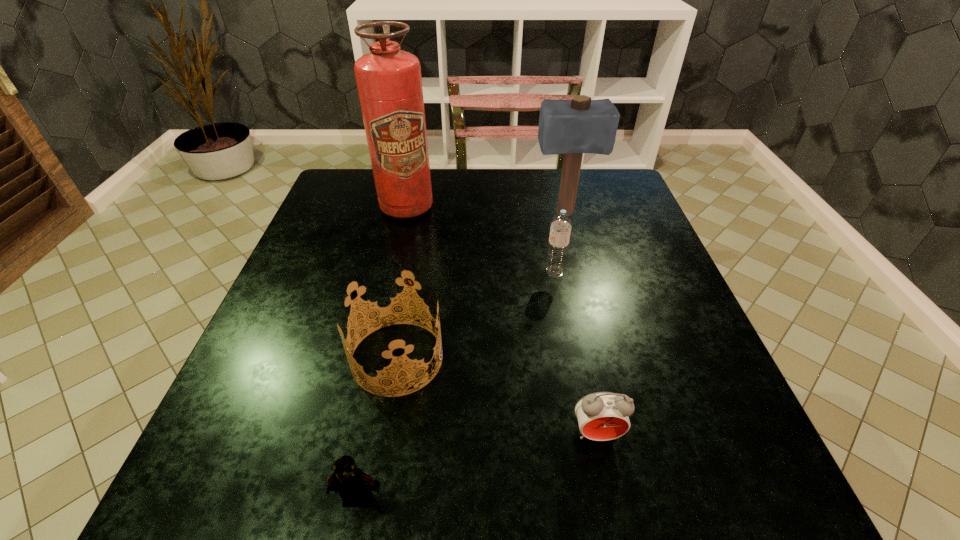
The image size is (960, 540). Identify the location of vacant space located 0.100m on the face of the second nearest object. (614, 516).

At what (x,y) coordinates should I click in order to perform the action: click on fire extinguisher located in the far edge section of the desktop. Please return your answer as a coordinate pair (x, y). This screenshot has width=960, height=540. Looking at the image, I should click on (389, 82).

I want to click on mallet that is at the far edge, so click(x=572, y=127).

Locate an element on the screen. Image resolution: width=960 pixels, height=540 pixels. object positioned at the near edge is located at coordinates (352, 484).

Find the location of a particular element. object that is at the left edge is located at coordinates (389, 82).

The width and height of the screenshot is (960, 540). In order to click on object situated at the right edge in this screenshot , I will do `click(572, 127)`.

Where is `object located in the far left corner section of the desktop`? This screenshot has height=540, width=960. object located in the far left corner section of the desktop is located at coordinates (389, 82).

This screenshot has width=960, height=540. Find the location of `object present at the far right corner`. object present at the far right corner is located at coordinates (572, 127).

Identify the location of vacant space at the far edge of the desktop. (480, 207).

This screenshot has width=960, height=540. In order to click on vacant space at the near edge in this screenshot , I will do `click(449, 456)`.